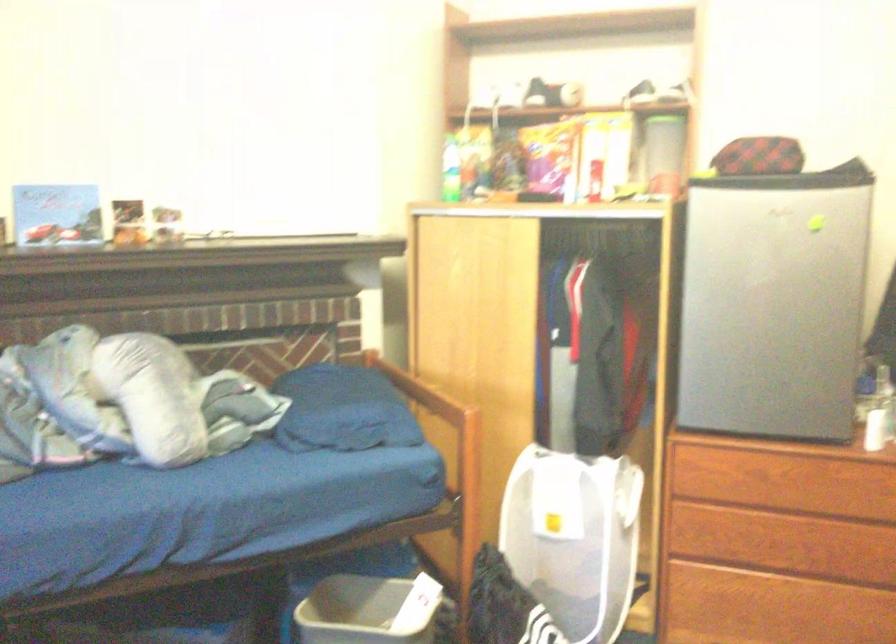
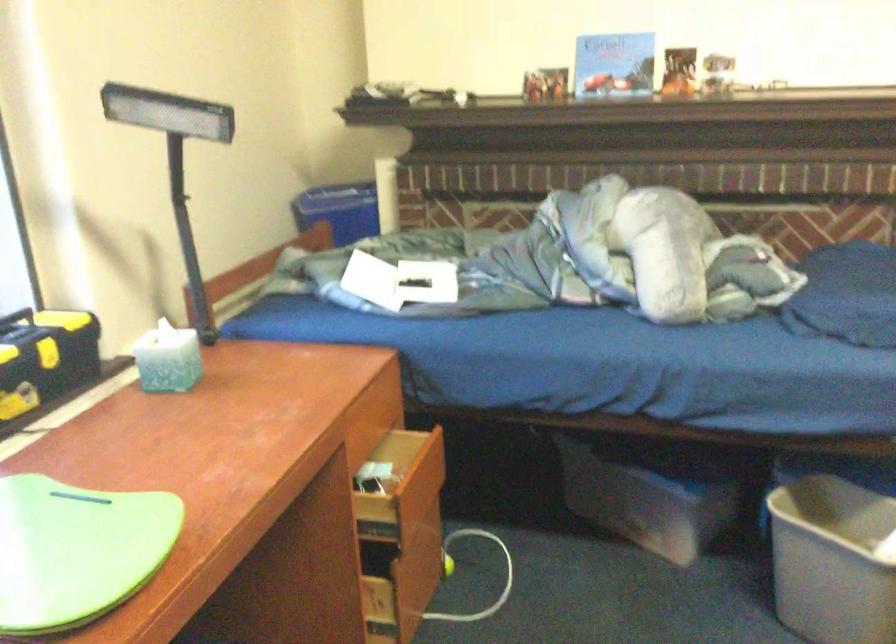
Question: The first image is from the beginning of the video and the second image is from the end. How did the camera likely rotate when shooting the video?

Choices:
 (A) Left
 (B) Right
 (C) Up
 (D) Down

Answer: (A)